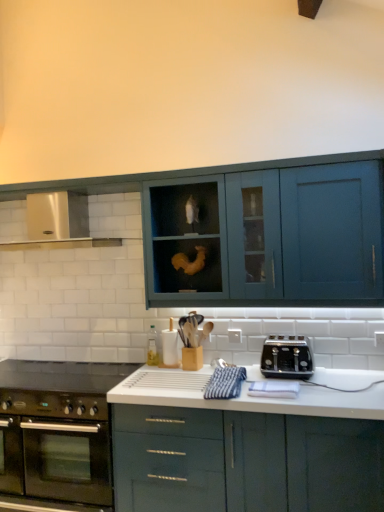
Identify the location of white glossy countertop at center, the second cabinetry in the top-to-bottom sequence. (176, 449).

This screenshot has width=384, height=512. What do you see at coordinates (287, 357) in the screenshot?
I see `satin silver toaster at right` at bounding box center [287, 357].

Measure the distance between satin silver toaster at right and camera.

satin silver toaster at right and camera are 2.31 meters apart from each other.

Identify the location of satin silver exhaust hood at upper left. This screenshot has width=384, height=512. (58, 223).

In order to click on black glass gas stove at lower left in this screenshot , I will do `click(63, 375)`.

From a real-world perspective, is stainless steel oven at lower left over satin silver exhaust hood at upper left?

No, from a real-world perspective, stainless steel oven at lower left is not above satin silver exhaust hood at upper left.

Looking at the image, does stainless steel oven at lower left seem bigger or smaller compared to satin silver exhaust hood at upper left?

stainless steel oven at lower left is bigger than satin silver exhaust hood at upper left.

Where is `oven that appears on the right of satin silver exhaust hood at upper left`? oven that appears on the right of satin silver exhaust hood at upper left is located at coordinates (57, 446).

Is stainless steel oven at lower left wider or thinner than satin silver exhaust hood at upper left?

In the image, stainless steel oven at lower left appears to be wider than satin silver exhaust hood at upper left.

Are black glass gas stove at lower left and matte blue cabinet at upper center, which ranks as the 1th cabinetry in top-to-bottom order, beside each other?

No.

Does point (97, 383) lie in front of point (54, 187)?

No, it is behind (54, 187).

Is black glass gas stove at lower left oriented away from matte blue cabinet at upper center, which ranks as the 1th cabinetry in top-to-bottom order?

black glass gas stove at lower left is not turned away from matte blue cabinet at upper center, which ranks as the 1th cabinetry in top-to-bottom order.

Does stainless steel oven at lower left have a greater height compared to matte blue cabinet at upper center, which ranks as the 1th cabinetry in top-to-bottom order?

→ No, stainless steel oven at lower left is not taller than matte blue cabinet at upper center, which ranks as the 1th cabinetry in top-to-bottom order.

From a real-world perspective, is stainless steel oven at lower left above or below matte blue cabinet at upper center, which appears as the second cabinetry when ordered from the bottom?

Clearly, from a real-world perspective, stainless steel oven at lower left is below matte blue cabinet at upper center, which appears as the second cabinetry when ordered from the bottom.

Between point (54, 490) and point (39, 191), which one is positioned behind?

The point (39, 191) is more distant.

Considering the relative sizes of stainless steel oven at lower left and matte blue cabinet at upper center, which ranks as the 1th cabinetry in top-to-bottom order, in the image provided, is stainless steel oven at lower left bigger than matte blue cabinet at upper center, which ranks as the 1th cabinetry in top-to-bottom order,?

Yes.

Based on the photo, is satin silver toaster at right smaller than stainless steel oven at lower left?

Correct, satin silver toaster at right occupies less space than stainless steel oven at lower left.

Is satin silver toaster at right further to camera compared to stainless steel oven at lower left?

Yes.

From a real-world perspective, is satin silver toaster at right located beneath stainless steel oven at lower left?

No, from a real-world perspective, satin silver toaster at right is not beneath stainless steel oven at lower left.

From the image's perspective, who appears lower, satin silver toaster at right or stainless steel oven at lower left?

stainless steel oven at lower left is shown below in the image.

Between satin silver toaster at right and matte blue cabinet at upper center, which appears as the second cabinetry when ordered from the bottom, which one is positioned behind?

satin silver toaster at right is further away from the camera.

Measure the distance between satin silver toaster at right and matte blue cabinet at upper center, which ranks as the 1th cabinetry in top-to-bottom order.

satin silver toaster at right and matte blue cabinet at upper center, which ranks as the 1th cabinetry in top-to-bottom order, are 25.47 inches apart.

Would you say satin silver toaster at right is inside or outside matte blue cabinet at upper center, which appears as the second cabinetry when ordered from the bottom?

satin silver toaster at right is outside matte blue cabinet at upper center, which appears as the second cabinetry when ordered from the bottom.

Considering the points (277, 338) and (109, 192), which point is in front, point (277, 338) or point (109, 192)?

The point (277, 338) is in front.

Which of these two, satin silver exhaust hood at upper left or stainless steel oven at lower left, stands taller?

stainless steel oven at lower left.

Are satin silver exhaust hood at upper left and stainless steel oven at lower left beside each other?

No, satin silver exhaust hood at upper left is not beside stainless steel oven at lower left.

How much distance is there between satin silver exhaust hood at upper left and stainless steel oven at lower left?

satin silver exhaust hood at upper left is 3.83 feet from stainless steel oven at lower left.

Would you consider white glossy countertop at center, which is the 1th cabinetry in bottom-to-top order, to be distant from satin silver exhaust hood at upper left?

Yes, white glossy countertop at center, which is the 1th cabinetry in bottom-to-top order, is far from satin silver exhaust hood at upper left.

Which object is positioned more to the right, white glossy countertop at center, the second cabinetry in the top-to-bottom sequence, or satin silver exhaust hood at upper left?

white glossy countertop at center, the second cabinetry in the top-to-bottom sequence.

From a real-world perspective, is white glossy countertop at center, which is the 1th cabinetry in bottom-to-top order, above or below satin silver exhaust hood at upper left?

Clearly, from a real-world perspective, white glossy countertop at center, which is the 1th cabinetry in bottom-to-top order, is below satin silver exhaust hood at upper left.

Which of these two, white glossy countertop at center, the second cabinetry in the top-to-bottom sequence, or satin silver exhaust hood at upper left, is thinner?

satin silver exhaust hood at upper left is thinner.

Find the location of a particular element. Image resolution: width=384 pixels, height=512 pixels. exhaust hood behind the stainless steel oven at lower left is located at coordinates (58, 223).

Where is `the 2nd cabinetry counting from the right of the black glass gas stove at lower left`? The width and height of the screenshot is (384, 512). the 2nd cabinetry counting from the right of the black glass gas stove at lower left is located at coordinates (267, 229).

Based on their spatial positions, is satin silver toaster at right or stainless steel oven at lower left further from matte blue cabinet at upper center, which appears as the second cabinetry when ordered from the bottom?

stainless steel oven at lower left lies further to matte blue cabinet at upper center, which appears as the second cabinetry when ordered from the bottom, than the other object.

When comparing their distances from stainless steel oven at lower left, does matte blue cabinet at upper center, which ranks as the 1th cabinetry in top-to-bottom order, or black glass gas stove at lower left seem further?

Among the two, matte blue cabinet at upper center, which ranks as the 1th cabinetry in top-to-bottom order, is located further to stainless steel oven at lower left.

Based on their spatial positions, is stainless steel oven at lower left or satin silver exhaust hood at upper left further from black glass gas stove at lower left?

satin silver exhaust hood at upper left lies further to black glass gas stove at lower left than the other object.

Based on their spatial positions, is matte blue cabinet at upper center, which appears as the second cabinetry when ordered from the bottom, or white glossy countertop at center, the second cabinetry in the top-to-bottom sequence, closer to stainless steel oven at lower left?

white glossy countertop at center, the second cabinetry in the top-to-bottom sequence.

Estimate the real-world distances between objects in this image. Which object is further from black glass gas stove at lower left, satin silver toaster at right or stainless steel oven at lower left?

The object further to black glass gas stove at lower left is satin silver toaster at right.

Estimate the real-world distances between objects in this image. Which object is further from satin silver exhaust hood at upper left, matte blue cabinet at upper center, which ranks as the 1th cabinetry in top-to-bottom order, or black glass gas stove at lower left?

black glass gas stove at lower left.

Based on their spatial positions, is stainless steel oven at lower left or matte blue cabinet at upper center, which ranks as the 1th cabinetry in top-to-bottom order, further from white glossy countertop at center, the second cabinetry in the top-to-bottom sequence?

Among the two, matte blue cabinet at upper center, which ranks as the 1th cabinetry in top-to-bottom order, is located further to white glossy countertop at center, the second cabinetry in the top-to-bottom sequence.

In the scene shown: Looking at the image, which one is located closer to satin silver toaster at right, matte blue cabinet at upper center, which ranks as the 1th cabinetry in top-to-bottom order, or black glass gas stove at lower left?

Based on the image, matte blue cabinet at upper center, which ranks as the 1th cabinetry in top-to-bottom order, appears to be nearer to satin silver toaster at right.

The image size is (384, 512). Identify the location of oven situated between black glass gas stove at lower left and satin silver toaster at right from left to right. (57, 446).

You are a GUI agent. You are given a task and a screenshot of the screen. Output one action in this format:
    pyautogui.click(x=<x>, y=<y>)
    Task: Click on the cabinetry between matte blue cabinet at upper center, which appears as the second cabinetry when ordered from the bottom, and stainless steel oven at lower left, in the vertical direction
    
    Given the screenshot: What is the action you would take?
    pyautogui.click(x=176, y=449)

What are the coordinates of `oven between black glass gas stove at lower left and matte blue cabinet at upper center, which ranks as the 1th cabinetry in top-to-bottom order, from left to right` in the screenshot? It's located at (57, 446).

Locate an element on the screen. toaster that lies between matte blue cabinet at upper center, which ranks as the 1th cabinetry in top-to-bottom order, and white glossy countertop at center, which is the 1th cabinetry in bottom-to-top order, from top to bottom is located at coordinates (287, 357).